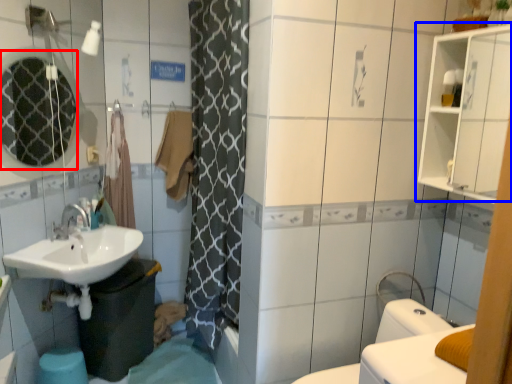
Question: Which object is closer to the camera taking this photo, mirror (highlighted by a red box) or medicine cabinet (highlighted by a blue box)?

Choices:
 (A) mirror
 (B) medicine cabinet

Answer: (B)